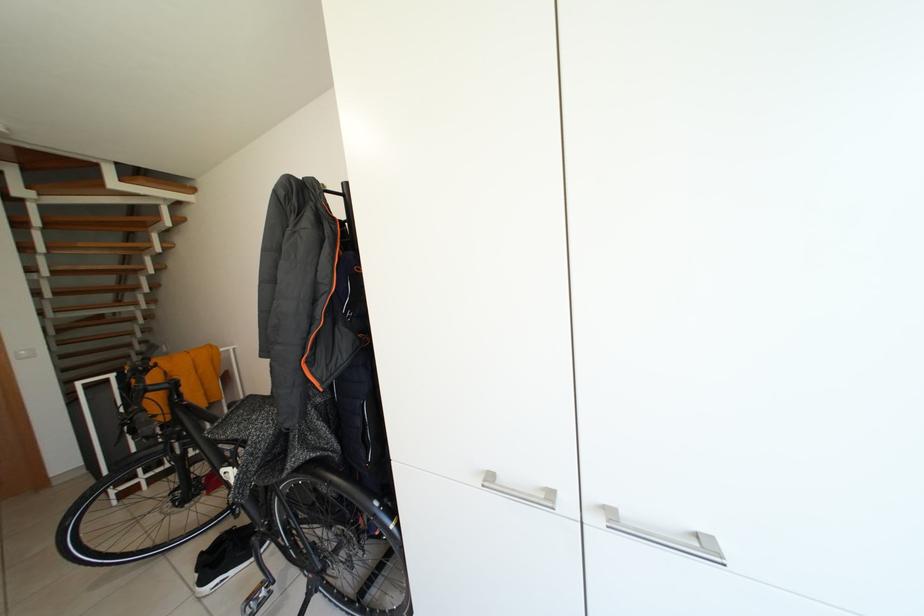
What do you see at coordinates (257, 598) in the screenshot?
I see `the bicycle pedal` at bounding box center [257, 598].